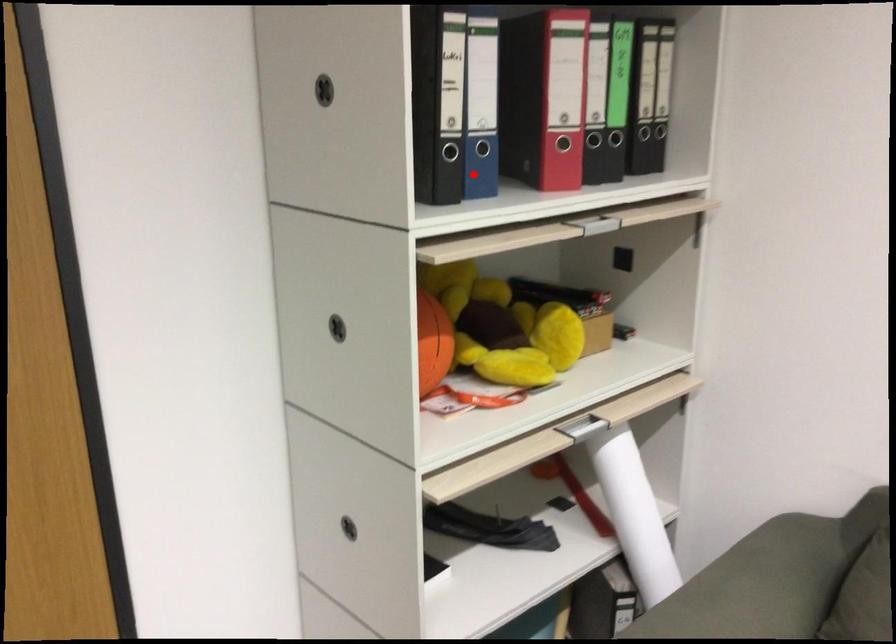
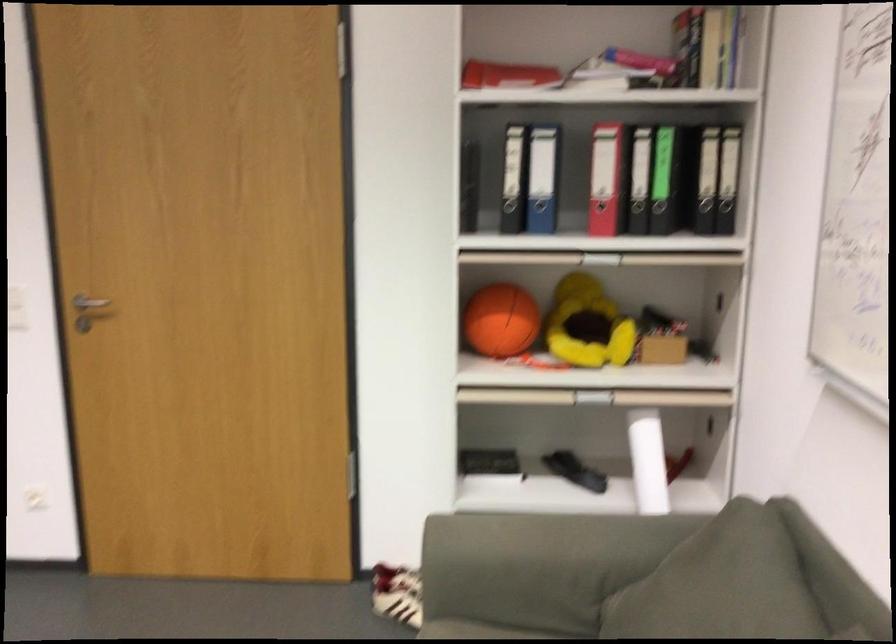
Question: I am providing you with two images of the same scene from different viewpoints. Given a red point in image1, look at the same physical point in image2. Is it:

Choices:
 (A) Closer to the viewpoint
 (B) Farther from the viewpoint

Answer: (B)